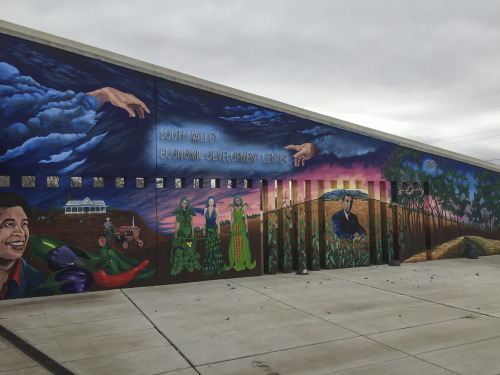
Locate an element on the screen. The image size is (500, 375). big mural on the wall is located at coordinates (195, 207).